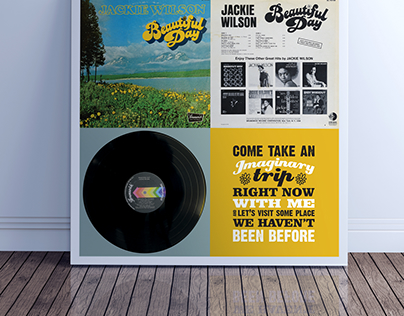
Locate an element on the screen. The height and width of the screenshot is (316, 404). floor is located at coordinates (210, 289).